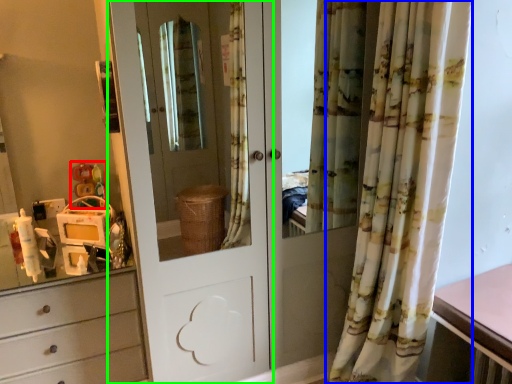
Question: Which object is the farthest from toy (highlighted by a red box)? Choose among these: curtain (highlighted by a blue box) or door (highlighted by a green box).

Choices:
 (A) curtain
 (B) door

Answer: (B)